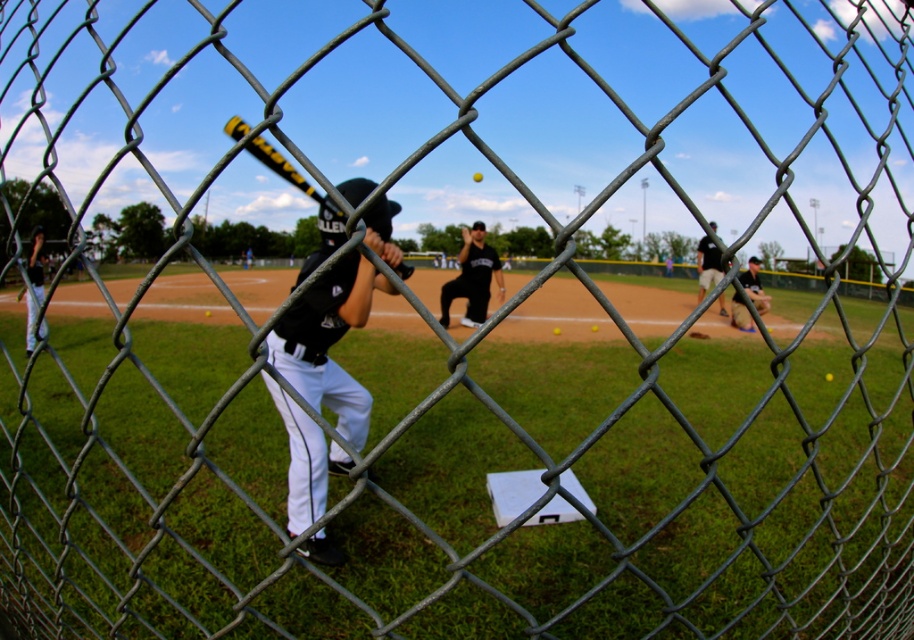
You are a photographer who wants to capture a clear photo of both the black matte uniform at center and the black jersey at center. Since the camera can only focus on one object at a time, which one should you choose to ensure the other remains in the background?

The black matte uniform at center is 26.45 feet away from the black jersey at center. To ensure one is in focus and the other in the background, you should focus on the closer object. However, since both are labeled as separate objects at the same position, it might indicate they are part of the same player. If they are separate, focus on whichever is closer to achieve depth of field with the other in blur.

You are a spectator at the baseball game and want to take a photo of both the black jersey at center and the black uniform at lower right. Which object should you focus on first if you want to capture both clearly in your photo?

The black jersey at center is to the left of black uniform at lower right, so you should focus on the black jersey at center first to ensure both are in focus since they are positioned side by side.

Based on the scene description, which object is taller between the matte black baseball bat at left and the black uniform at lower right?

The matte black baseball bat at left is taller than the black uniform at lower right.